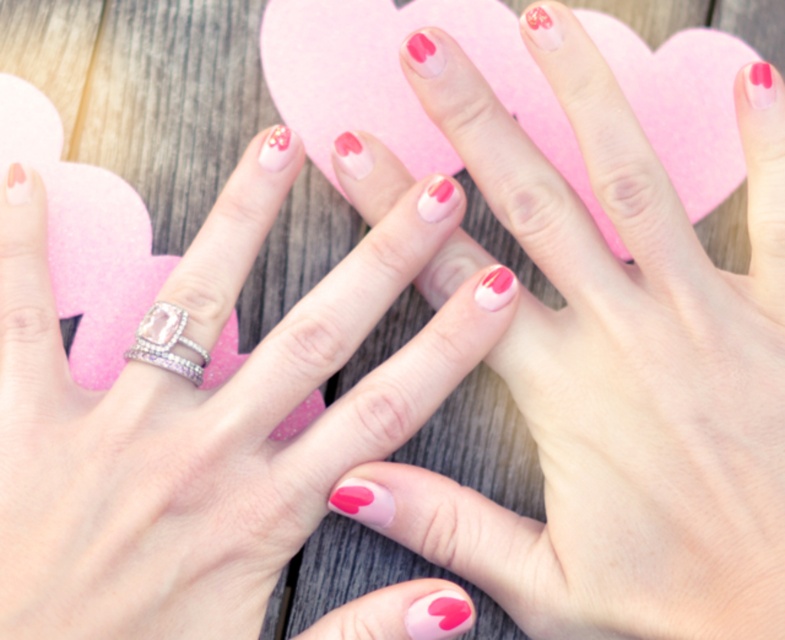
You are a jeweler examining the pink matte nails at center and the clear crystal ring at center. Which object would you say is bigger in size?

The pink matte nails at center has a larger size compared to the clear crystal ring at center, so the pink matte nails at center is bigger.

Consider the image. You are a nail artist trying to create a design that matches the pink matte nails at center and the matte pink nail polish at center. Which object should you focus on first to ensure the design aligns properly with their sizes?

The pink matte nails at center is much taller than the matte pink nail polish at center, so you should focus on the pink matte nails at center first to ensure the design aligns properly with their sizes.

You are a jeweler examining the clear crystal ring at center and the pink matte nails at center. Which object is positioned higher in the image?

The pink matte nails at center is above clear crystal ring at center, so the pink matte nails at center is positioned higher.